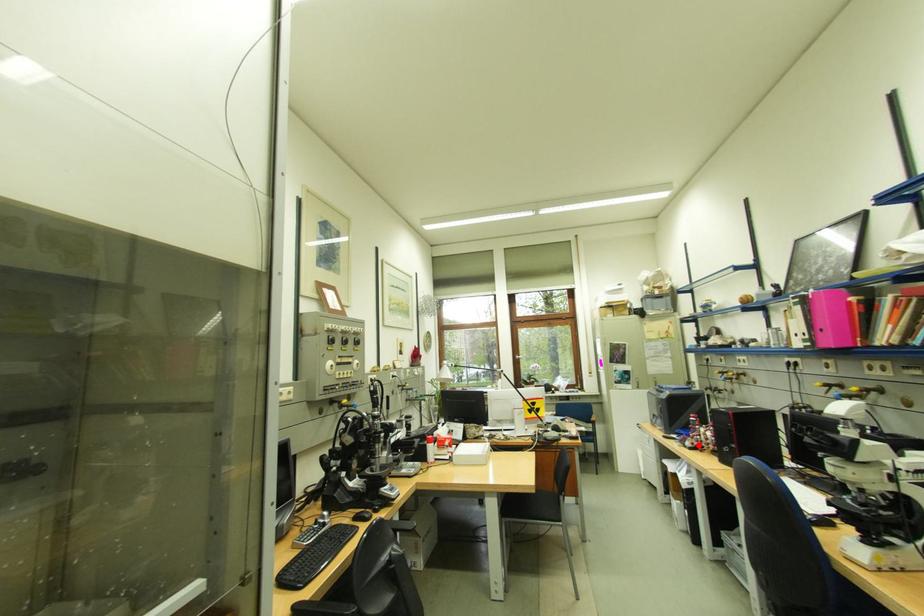
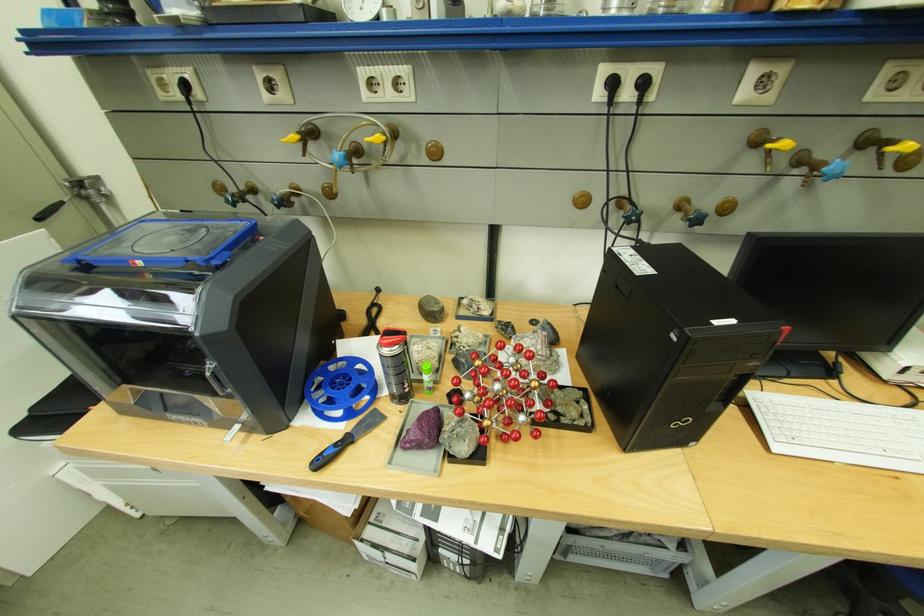
The point at the highlighted location is marked in the first image. Where is the corresponding point in the second image?

(475, 448)